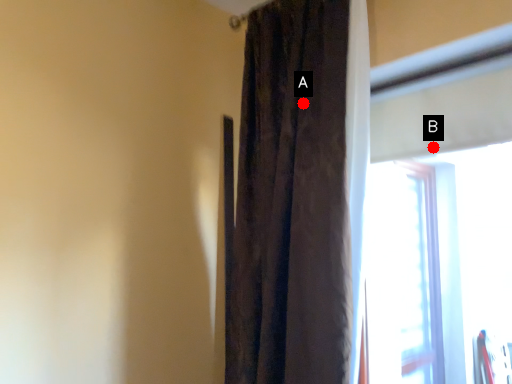
Question: Two points are circled on the image, labeled by A and B beside each circle. Which point is further to the camera?

Choices:
 (A) A is further
 (B) B is further

Answer: (B)